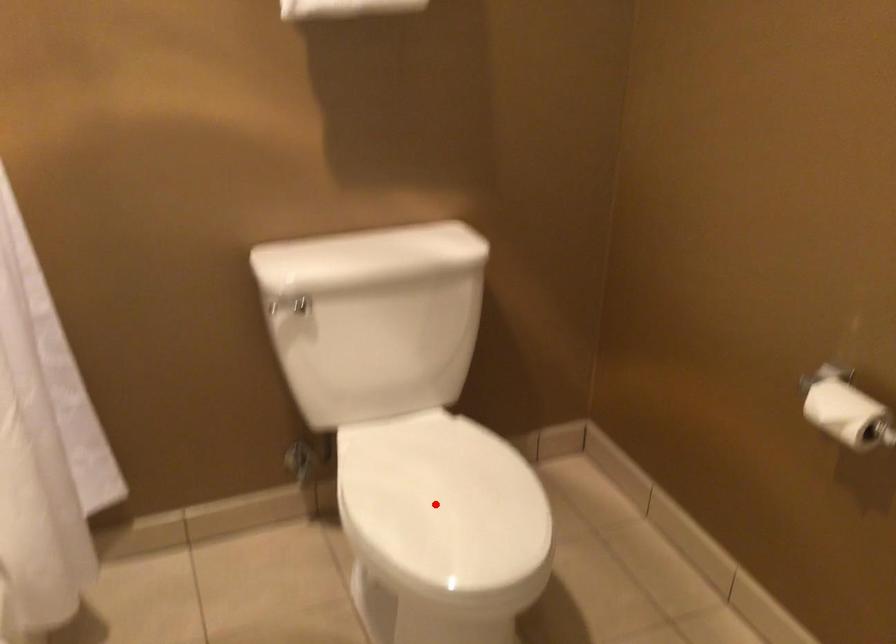
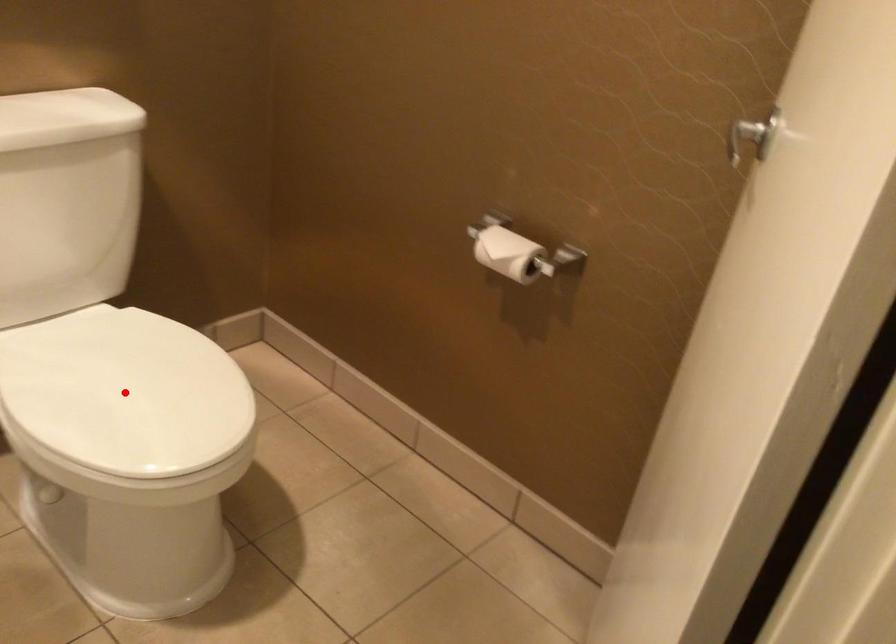
Based on the photo, I am providing you with two images of the same scene from different viewpoints. A red point is marked on the first image and another point is marked on the second image. Is the red point in image1 aligned with the point shown in image2?

Yes